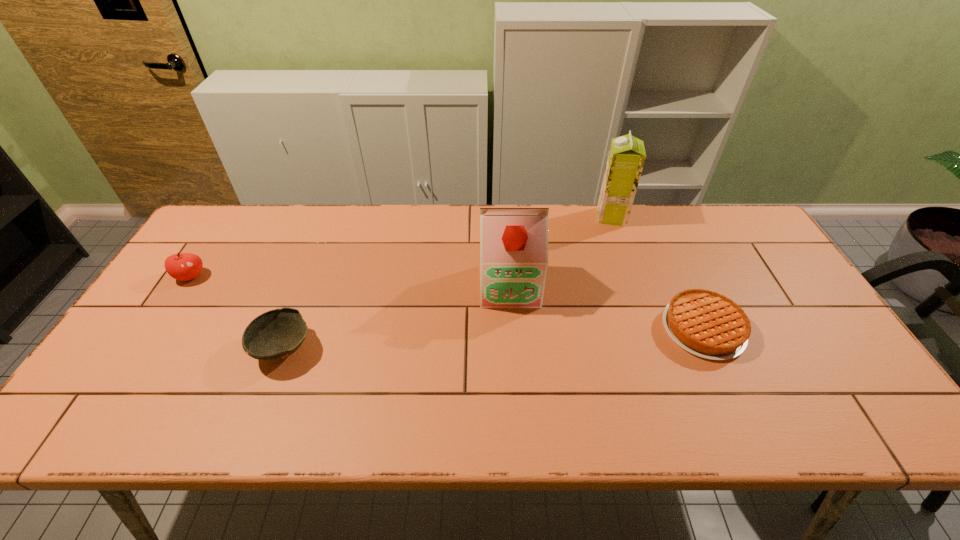
This screenshot has height=540, width=960. In order to click on unoccupied position between the nearer soya milk and the shortest object in this screenshot , I will do click(606, 307).

Identify the location of unoccupied position between the leftmost object and the left soya milk. (350, 281).

Image resolution: width=960 pixels, height=540 pixels. In order to click on vacant space that's between the second object from left to right and the right soya milk in this screenshot , I will do `click(447, 282)`.

I want to click on free area in between the second object from left to right and the shortest object, so click(493, 339).

Where is `free space between the pie and the fourth tallest object`? The width and height of the screenshot is (960, 540). free space between the pie and the fourth tallest object is located at coordinates (493, 339).

The image size is (960, 540). Identify the location of vacant area that lies between the pie and the fourth tallest object. (493, 339).

Identify the location of free space that is in between the left soya milk and the third shortest object. (350, 281).

Locate an element on the screen. unoccupied area between the farthest object and the bowl is located at coordinates (447, 282).

Locate an element on the screen. The image size is (960, 540). empty location between the left soya milk and the second shortest object is located at coordinates (396, 317).

At what (x,y) coordinates should I click in order to perform the action: click on free point between the nearer soya milk and the farther soya milk. Please return your answer as a coordinate pair (x, y). The height and width of the screenshot is (540, 960). Looking at the image, I should click on (561, 251).